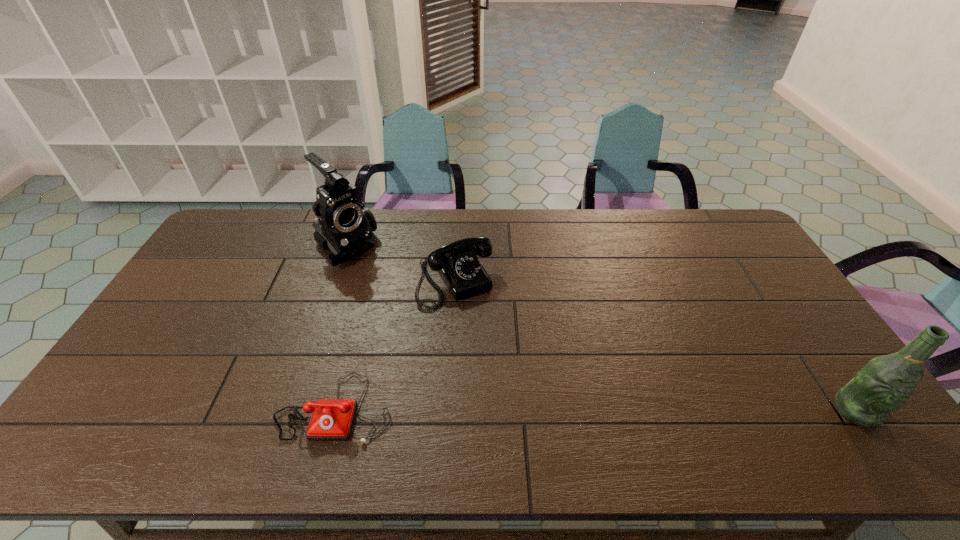
The height and width of the screenshot is (540, 960). I want to click on the shortest object, so click(332, 419).

Locate an element on the screen. The image size is (960, 540). the left telephone is located at coordinates (332, 419).

Identify the location of beer bottle. (885, 383).

Locate an element on the screen. The height and width of the screenshot is (540, 960). the right telephone is located at coordinates (457, 262).

Identify the location of the third object from left to right. (457, 262).

Identify the location of camcorder. (345, 226).

Find the location of `vacant region located 0.080m on the dial of the third object from left to right`. vacant region located 0.080m on the dial of the third object from left to right is located at coordinates point(481,327).

Where is `blank space located on the dial of the third object from left to right`? blank space located on the dial of the third object from left to right is located at coordinates (500, 360).

The image size is (960, 540). I want to click on free space located 0.360m on the dial of the third object from left to right, so click(x=526, y=404).

Locate an element on the screen. This screenshot has width=960, height=540. vacant area situated on the lens mount of the camcorder is located at coordinates (431, 328).